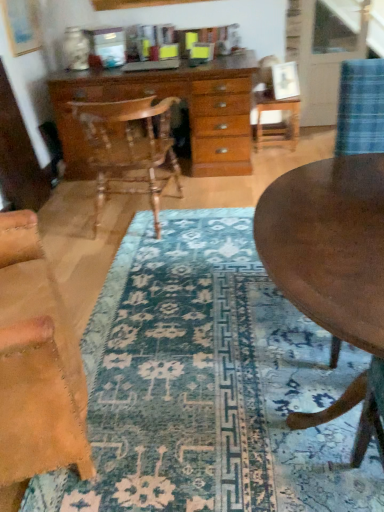
Question: Is blue patterned rug at center to the left of wooden round table at center from the viewer's perspective?

Choices:
 (A) no
 (B) yes

Answer: (B)

Question: From a real-world perspective, is blue patterned rug at center on wooden round table at center?

Choices:
 (A) yes
 (B) no

Answer: (B)

Question: Would you say blue patterned rug at center is outside wooden round table at center?

Choices:
 (A) no
 (B) yes

Answer: (B)

Question: Is blue patterned rug at center at the right side of wooden round table at center?

Choices:
 (A) yes
 (B) no

Answer: (B)

Question: Does blue patterned rug at center lie in front of wooden round table at center?

Choices:
 (A) no
 (B) yes

Answer: (A)

Question: Considering the relative sizes of blue patterned rug at center and wooden round table at center in the image provided, is blue patterned rug at center bigger than wooden round table at center?

Choices:
 (A) yes
 (B) no

Answer: (B)

Question: From the image's perspective, is leather at left, the 2th chair when ordered from top to bottom, under wooden side table at center?

Choices:
 (A) yes
 (B) no

Answer: (A)

Question: Is there a large distance between leather at left, the 2th chair when ordered from top to bottom, and wooden side table at center?

Choices:
 (A) no
 (B) yes

Answer: (B)

Question: Is leather at left, the first chair positioned from the front, located outside wooden side table at center?

Choices:
 (A) yes
 (B) no

Answer: (A)

Question: Is leather at left, the second chair positioned from the back, bigger than wooden side table at center?

Choices:
 (A) no
 (B) yes

Answer: (B)

Question: Does leather at left, the 2th chair when ordered from top to bottom, have a greater height compared to wooden side table at center?

Choices:
 (A) yes
 (B) no

Answer: (A)

Question: Is leather at left, the 2th chair when ordered from top to bottom, thinner than wooden side table at center?

Choices:
 (A) yes
 (B) no

Answer: (A)

Question: Does wooden chest of drawers at center have a lesser width compared to wooden polished chair at center, which is the first chair in top-to-bottom order?

Choices:
 (A) yes
 (B) no

Answer: (B)